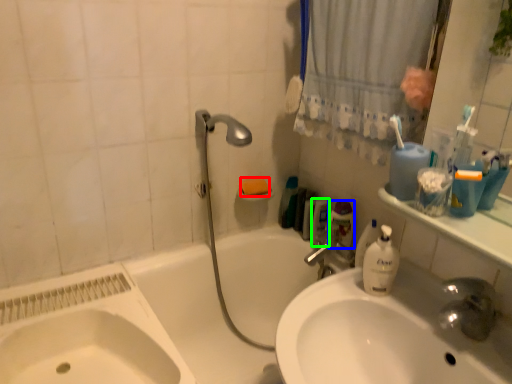
Question: Which is farther away from soap (highlighted by a red box)? toiletry (highlighted by a blue box) or mouthwash (highlighted by a green box)?

Choices:
 (A) toiletry
 (B) mouthwash

Answer: (A)